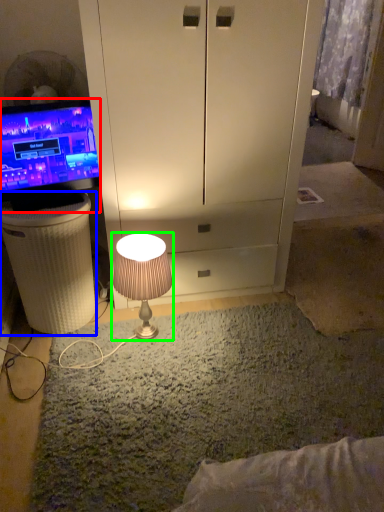
Question: Which object is positioned farthest from television (highlighted by a red box)? Select from vanity (highlighted by a blue box) and lamp (highlighted by a green box).

Choices:
 (A) vanity
 (B) lamp

Answer: (B)